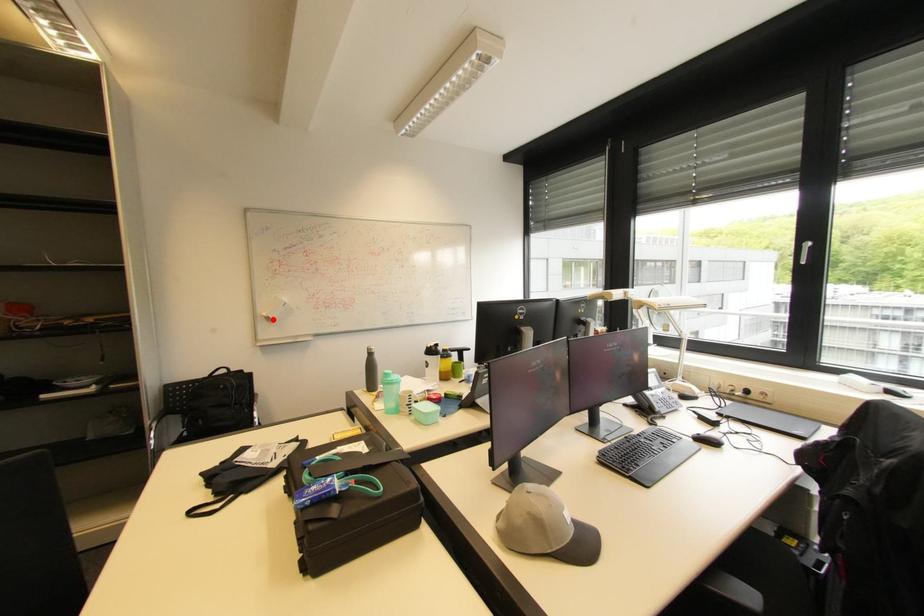
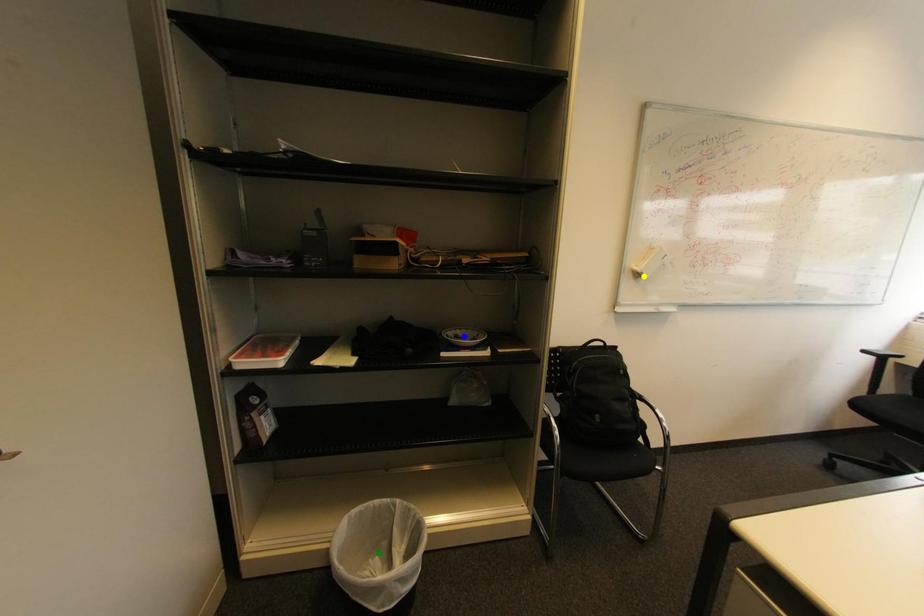
Question: I am providing you with two images of the same scene from different viewpoints. A red point is marked on the first image. You are given multiple points on the second image. Which point in image 2 represents the same 3d spot as the red point in image 1?

Choices:
 (A) yellow point
 (B) blue point
 (C) green point

Answer: (A)